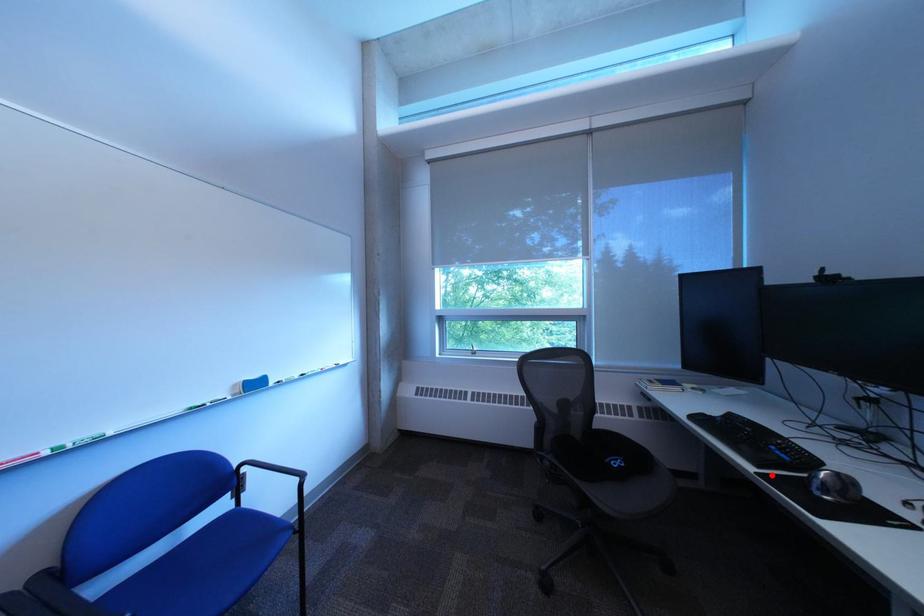
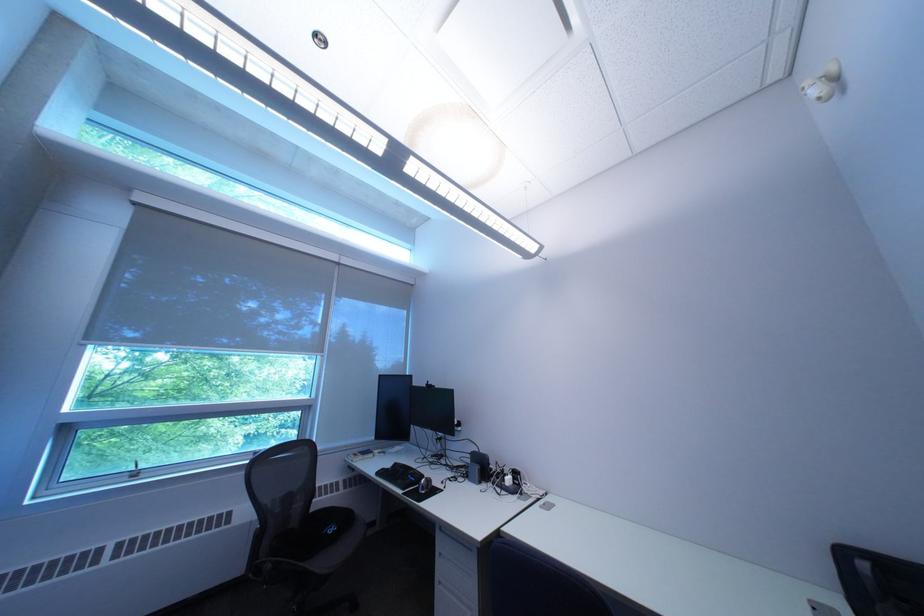
The point at the highlighted location is marked in the first image. Where is the corresponding point in the second image?

(418, 495)